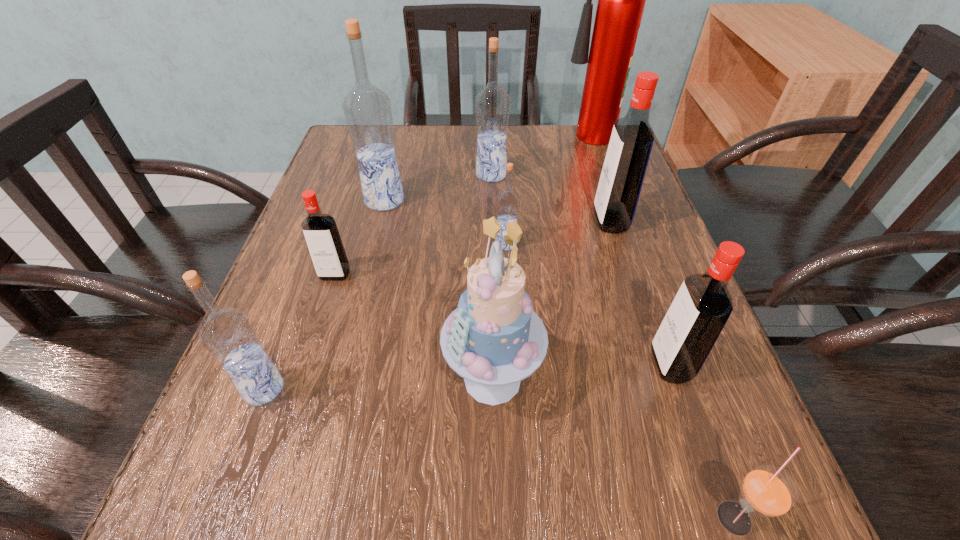
This screenshot has width=960, height=540. Find the location of `free point located 0.240m on the front and back of the farthest red vodka`. free point located 0.240m on the front and back of the farthest red vodka is located at coordinates (480, 221).

Locate an element on the screen. This screenshot has width=960, height=540. vacant point located on the front and back of the farthest red vodka is located at coordinates (461, 221).

Locate an element on the screen. Image resolution: width=960 pixels, height=540 pixels. blank space located on the front and back of the farthest red vodka is located at coordinates (418, 221).

I want to click on vacant point located with a ladder on the side of the blue cake, so coord(378,380).

I want to click on vacant position located with a ladder on the side of the blue cake, so click(271, 380).

Find the location of `free space located with a ladder on the side of the blue cake`. free space located with a ladder on the side of the blue cake is located at coordinates (257, 380).

The height and width of the screenshot is (540, 960). Find the location of `vacant space located 0.060m on the front and back of the second biggest red vodka`. vacant space located 0.060m on the front and back of the second biggest red vodka is located at coordinates (614, 364).

The width and height of the screenshot is (960, 540). Find the location of `free space located on the front and back of the second biggest red vodka`. free space located on the front and back of the second biggest red vodka is located at coordinates (511, 364).

What are the coordinates of `free location located 0.390m on the front and back of the second biggest red vodka` in the screenshot? It's located at (399, 364).

The width and height of the screenshot is (960, 540). What are the coordinates of `vacant area situated on the right of the leftmost blue vodka` in the screenshot? It's located at (522, 389).